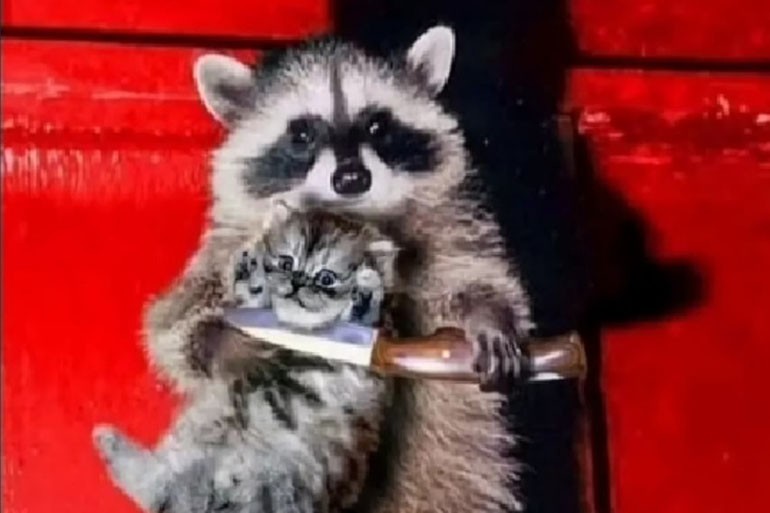
Identify the location of knife handle. This screenshot has height=513, width=770. (429, 358).